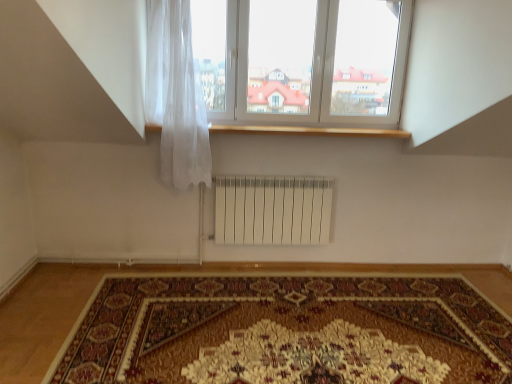
Question: Can you confirm if translucent white curtain at upper left is smaller than white plastic window at upper center?

Choices:
 (A) no
 (B) yes

Answer: (B)

Question: From a real-world perspective, is translucent white curtain at upper left below white plastic window at upper center?

Choices:
 (A) yes
 (B) no

Answer: (A)

Question: Is translucent white curtain at upper left in front of white plastic window at upper center?

Choices:
 (A) no
 (B) yes

Answer: (B)

Question: From a real-world perspective, is translucent white curtain at upper left on white plastic window at upper center?

Choices:
 (A) yes
 (B) no

Answer: (B)

Question: Is translucent white curtain at upper left wider than white plastic window at upper center?

Choices:
 (A) no
 (B) yes

Answer: (B)

Question: Is translucent white curtain at upper left oriented towards white plastic window at upper center?

Choices:
 (A) no
 (B) yes

Answer: (A)

Question: Is wooden at upper center in contact with white plastic window at upper center?

Choices:
 (A) no
 (B) yes

Answer: (A)

Question: From a real-world perspective, does wooden at upper center sit lower than white plastic window at upper center?

Choices:
 (A) no
 (B) yes

Answer: (B)

Question: Can you confirm if wooden at upper center is positioned to the right of white plastic window at upper center?

Choices:
 (A) no
 (B) yes

Answer: (A)

Question: From the image's perspective, is wooden at upper center under white plastic window at upper center?

Choices:
 (A) yes
 (B) no

Answer: (A)

Question: Is wooden at upper center thinner than white plastic window at upper center?

Choices:
 (A) no
 (B) yes

Answer: (A)

Question: Does wooden at upper center have a larger size compared to white plastic window at upper center?

Choices:
 (A) no
 (B) yes

Answer: (A)

Question: From a real-world perspective, is translucent white curtain at upper left positioned over carpeted rug at center based on gravity?

Choices:
 (A) yes
 (B) no

Answer: (A)